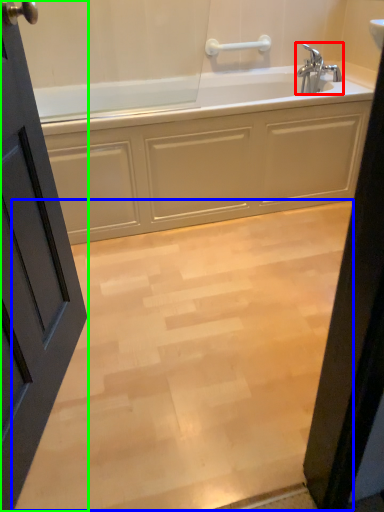
Question: Which is nearer to the tap (highlighted by a red box)? plain (highlighted by a blue box) or door (highlighted by a green box).

Choices:
 (A) plain
 (B) door

Answer: (A)